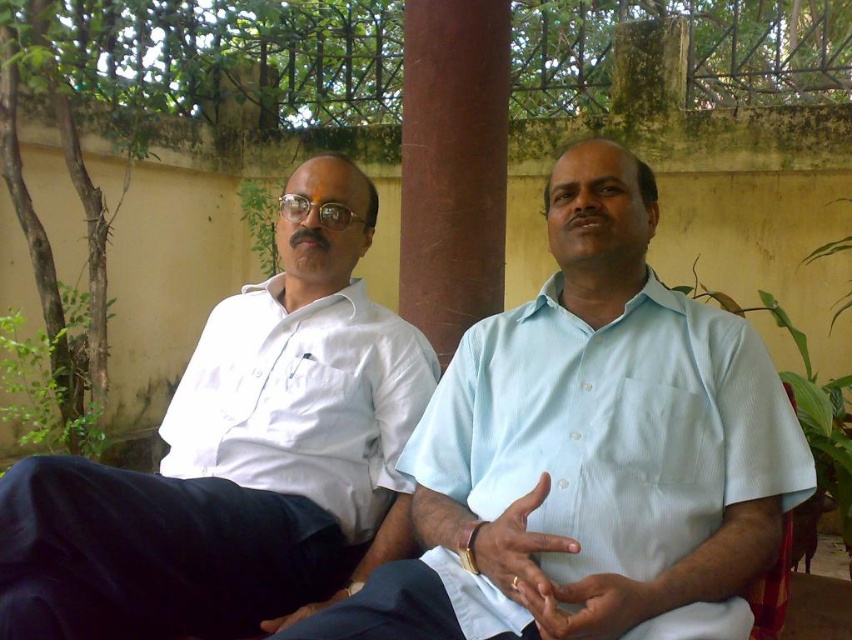
You are a tailor measuring shirts for two customers. You have a standard size chart. The white cotton shirt at left and the light blue cotton shirt at center are both in front of you. Which shirt requires more fabric according to their sizes?

The white cotton shirt at left requires more fabric because it is bigger than the light blue cotton shirt at center.

You are a painter standing in the courtyard and want to paint the white smooth shirt at left and the brown polished wood at center. If your paintbrush can reach 30 inches, can you paint both objects without moving your position?

The white smooth shirt at left is 28.79 inches from the brown polished wood at center, so yes, you can paint both objects without moving your position since the distance between them is within the 30 inches reach of your paintbrush.

You are designing a group photo and need to arrange two people wearing the white cotton shirt at left and the light blue cotton shirt at center. Based on their sizes, which person should you place closer to the camera to maintain a balanced composition?

The white cotton shirt at left is narrower than the light blue cotton shirt at center, so placing the person in the white cotton shirt at left closer to the camera will help balance their sizes in the composition.